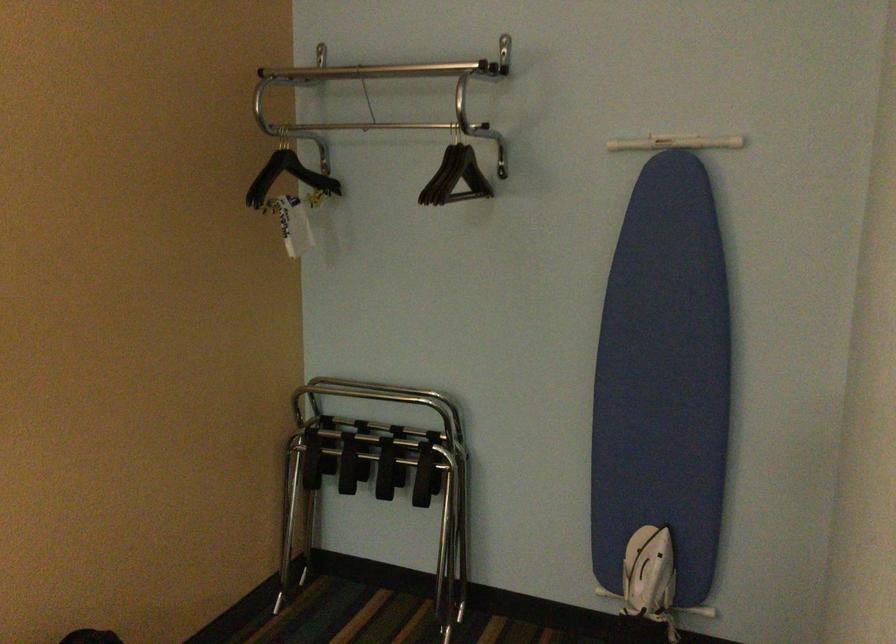
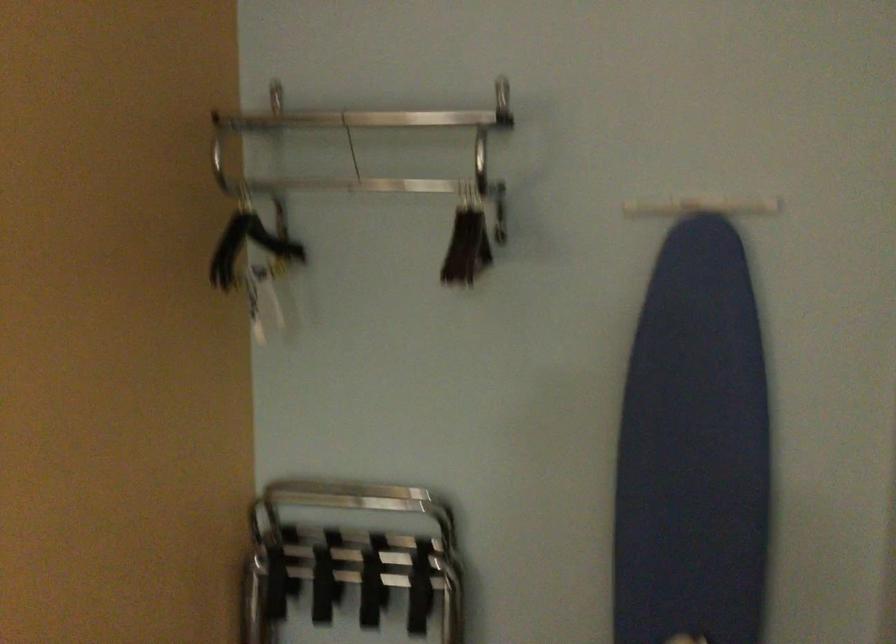
Which direction would the cameraman need to move to produce the second image?

The cameraman walked toward left, forward.